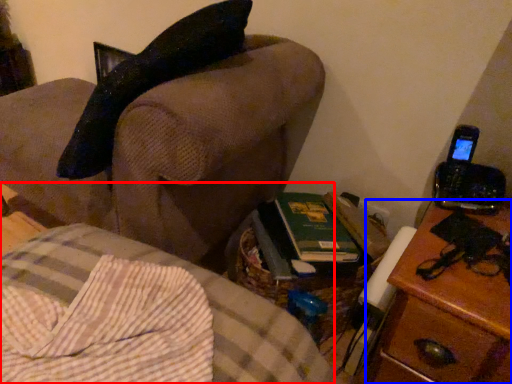
Question: Which object appears farthest to the camera in this image, furniture (highlighted by a red box) or nightstand (highlighted by a blue box)?

Choices:
 (A) furniture
 (B) nightstand

Answer: (B)